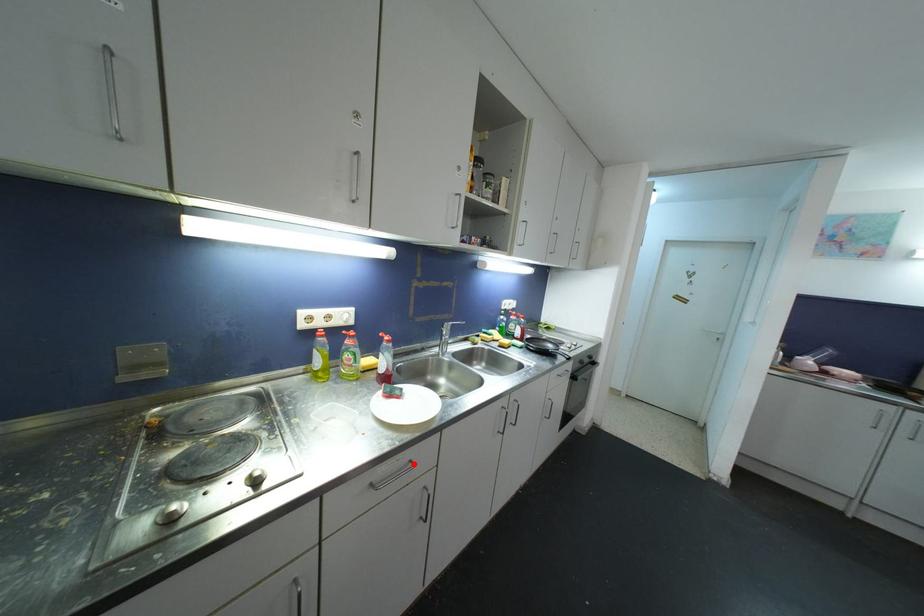
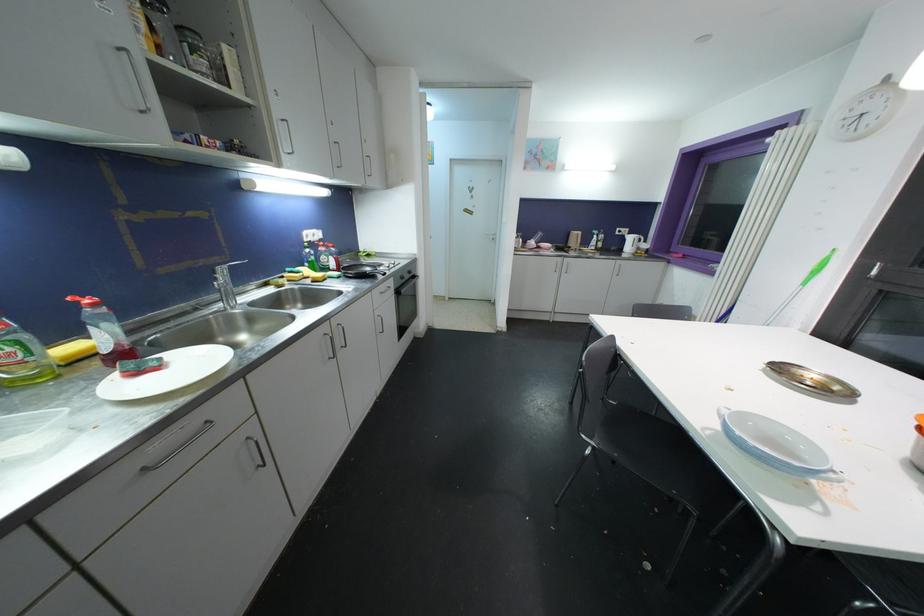
Locate, in the second image, the point that corresponds to the highlighted location in the first image.

(210, 424)